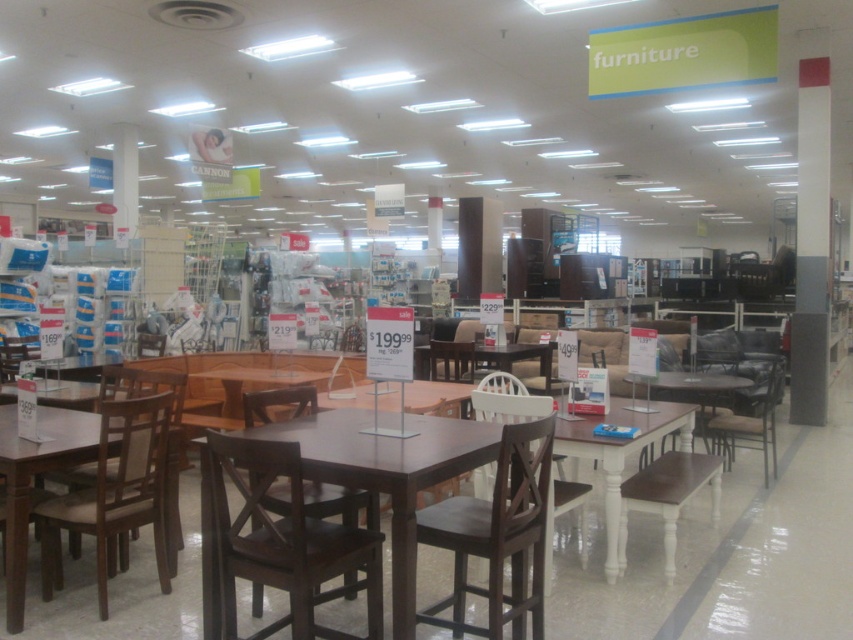
This screenshot has height=640, width=853. I want to click on dark wood table at center, so click(387, 472).

Which is in front, point (296, 435) or point (469, 538)?

Positioned in front is point (469, 538).

Locate an element on the screen. dark wood table at center is located at coordinates (387, 472).

Is dark wood chair at center thinner than matte brown chair at left?

No.

Can you confirm if dark wood chair at center is wider than matte brown chair at left?

Yes.

This screenshot has width=853, height=640. Find the location of `dark wood chair at center`. dark wood chair at center is located at coordinates (285, 540).

Identify the location of dark wood chair at center. (285, 540).

Is dark brown wood chair at center to the left of matte brown chair at left from the viewer's perspective?

No, dark brown wood chair at center is not to the left of matte brown chair at left.

Can you confirm if dark brown wood chair at center is smaller than matte brown chair at left?

Yes, dark brown wood chair at center is smaller than matte brown chair at left.

Who is more forward, (433, 532) or (103, 604)?

Point (433, 532) is more forward.

The width and height of the screenshot is (853, 640). In order to click on dark brown wood chair at center in this screenshot , I will do `click(497, 536)`.